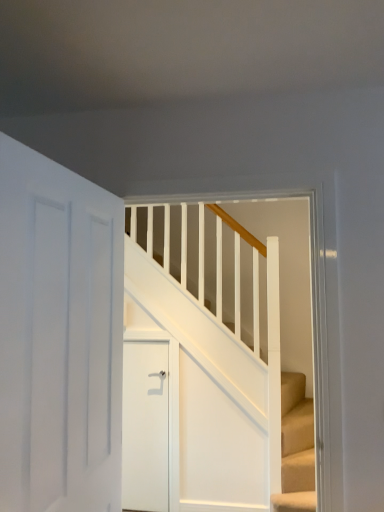
Question: Should I look upward or downward to see white wooden stairs at center?

Choices:
 (A) up
 (B) down

Answer: (B)

Question: Is white wooden stairs at center taller than white matte door at center, positioned as the second door in front-to-back order?

Choices:
 (A) no
 (B) yes

Answer: (B)

Question: Can you confirm if white wooden stairs at center is shorter than white matte door at center, the first door from the back?

Choices:
 (A) no
 (B) yes

Answer: (A)

Question: From a real-world perspective, is white wooden stairs at center located beneath white matte door at center, positioned as the second door in front-to-back order?

Choices:
 (A) no
 (B) yes

Answer: (A)

Question: Is white wooden stairs at center located outside white matte door at center, positioned as the second door in front-to-back order?

Choices:
 (A) no
 (B) yes

Answer: (B)

Question: Is white wooden stairs at center directly adjacent to white matte door at center, positioned as the second door in front-to-back order?

Choices:
 (A) yes
 (B) no

Answer: (B)

Question: Is white wooden stairs at center to the right of white matte door at center, the first door from the back, from the viewer's perspective?

Choices:
 (A) no
 (B) yes

Answer: (B)

Question: Considering the relative sizes of white matte door at left, the 1th door positioned from the front, and white wooden stairs at center in the image provided, is white matte door at left, the 1th door positioned from the front, taller than white wooden stairs at center?

Choices:
 (A) yes
 (B) no

Answer: (B)

Question: Is white matte door at left, the 1th door positioned from the front, completely or partially outside of white wooden stairs at center?

Choices:
 (A) yes
 (B) no

Answer: (A)

Question: From the image's perspective, is white matte door at left, which appears as the second door when viewed from the back, on top of white wooden stairs at center?

Choices:
 (A) no
 (B) yes

Answer: (B)

Question: Is white matte door at left, which appears as the second door when viewed from the back, shorter than white wooden stairs at center?

Choices:
 (A) yes
 (B) no

Answer: (A)

Question: Is white matte door at left, the 1th door positioned from the front, to the right of white wooden stairs at center from the viewer's perspective?

Choices:
 (A) no
 (B) yes

Answer: (A)

Question: Considering the relative positions of white matte door at left, which appears as the second door when viewed from the back, and white wooden stairs at center in the image provided, is white matte door at left, which appears as the second door when viewed from the back, to the left of white wooden stairs at center from the viewer's perspective?

Choices:
 (A) yes
 (B) no

Answer: (A)

Question: Could you tell me if white matte door at center, the first door from the back, is turned towards white wooden stairs at center?

Choices:
 (A) yes
 (B) no

Answer: (B)